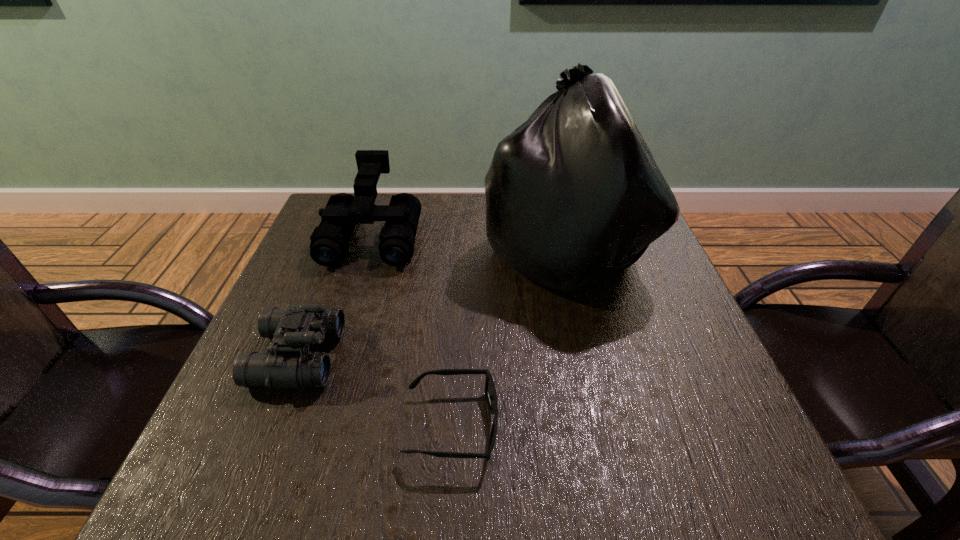
Locate an element on the screen. The image size is (960, 540). free space between the shortest object and the second shortest object is located at coordinates (375, 391).

Identify the location of vacant area that lies between the nearer binoculars and the shortest object. (375, 391).

Where is `vacant point located between the plastic bag and the farther binoculars`? vacant point located between the plastic bag and the farther binoculars is located at coordinates (468, 242).

Where is `unoccupied area between the taller binoculars and the sunglasses`? The height and width of the screenshot is (540, 960). unoccupied area between the taller binoculars and the sunglasses is located at coordinates (413, 330).

Where is `free space between the tallest object and the sunglasses`? free space between the tallest object and the sunglasses is located at coordinates (508, 337).

Locate an element on the screen. The height and width of the screenshot is (540, 960). free space between the shorter binoculars and the plastic bag is located at coordinates (430, 302).

Image resolution: width=960 pixels, height=540 pixels. I want to click on vacant region between the sunglasses and the third tallest object, so click(x=375, y=391).

This screenshot has width=960, height=540. In order to click on free area in between the nearer binoculars and the plastic bag in this screenshot , I will do click(x=430, y=302).

This screenshot has height=540, width=960. Find the location of `free spot between the nearer binoculars and the sunglasses`. free spot between the nearer binoculars and the sunglasses is located at coordinates (375, 391).

This screenshot has height=540, width=960. I want to click on free spot between the sunglasses and the farther binoculars, so click(413, 330).